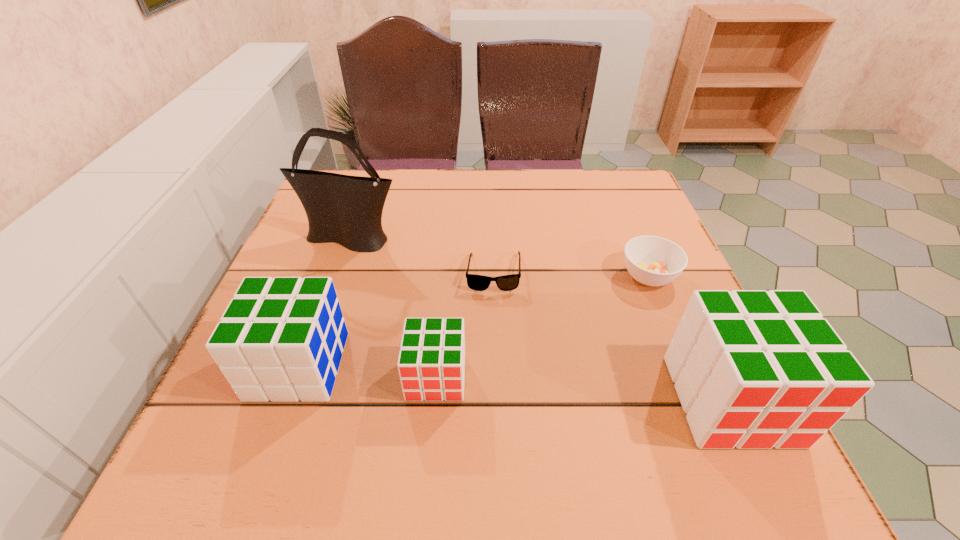
Where is `free space located on the front of the farthest object`? The image size is (960, 540). free space located on the front of the farthest object is located at coordinates (305, 367).

Find the location of `vacant position located on the left of the soup bowl`. vacant position located on the left of the soup bowl is located at coordinates (487, 276).

Where is `cube present at the left edge`? This screenshot has height=540, width=960. cube present at the left edge is located at coordinates (281, 339).

Identify the location of shoulder bag that is at the left edge. (343, 209).

Where is `cube present at the right edge`? The width and height of the screenshot is (960, 540). cube present at the right edge is located at coordinates (753, 369).

The width and height of the screenshot is (960, 540). Find the location of `soup bowl located in the right edge section of the desktop`. soup bowl located in the right edge section of the desktop is located at coordinates (651, 260).

Locate an element on the screen. This screenshot has height=540, width=960. object located at the near left corner is located at coordinates (281, 339).

Locate an element on the screen. The height and width of the screenshot is (540, 960). object at the near right corner is located at coordinates (753, 369).

Where is `free space at the far edge of the desktop`? This screenshot has height=540, width=960. free space at the far edge of the desktop is located at coordinates (400, 178).

Find the location of a particular element. free space at the near edge of the desktop is located at coordinates (369, 411).